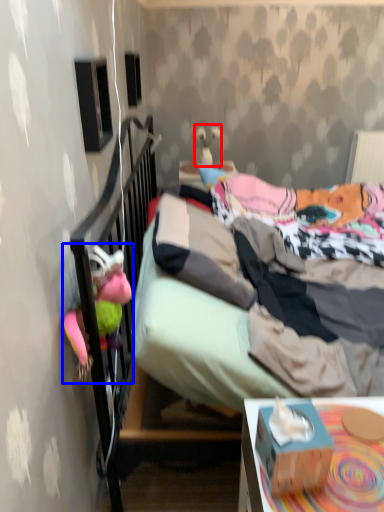
Question: Among these objects, which one is farthest to the camera, toy (highlighted by a red box) or toy (highlighted by a blue box)?

Choices:
 (A) toy
 (B) toy

Answer: (A)